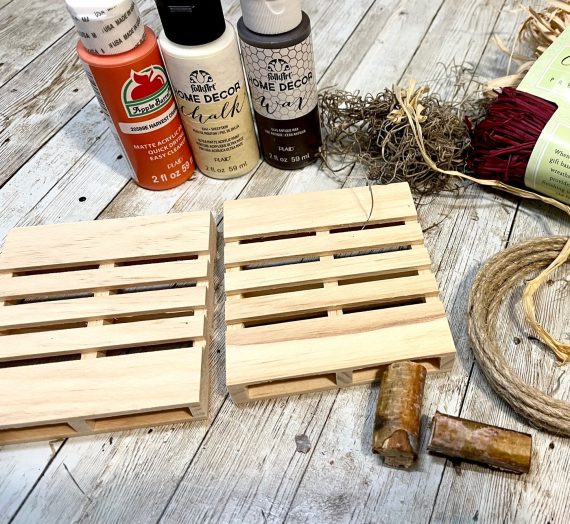
Find the location of a particular element. This screenshot has height=524, width=570. decor is located at coordinates (219, 93).